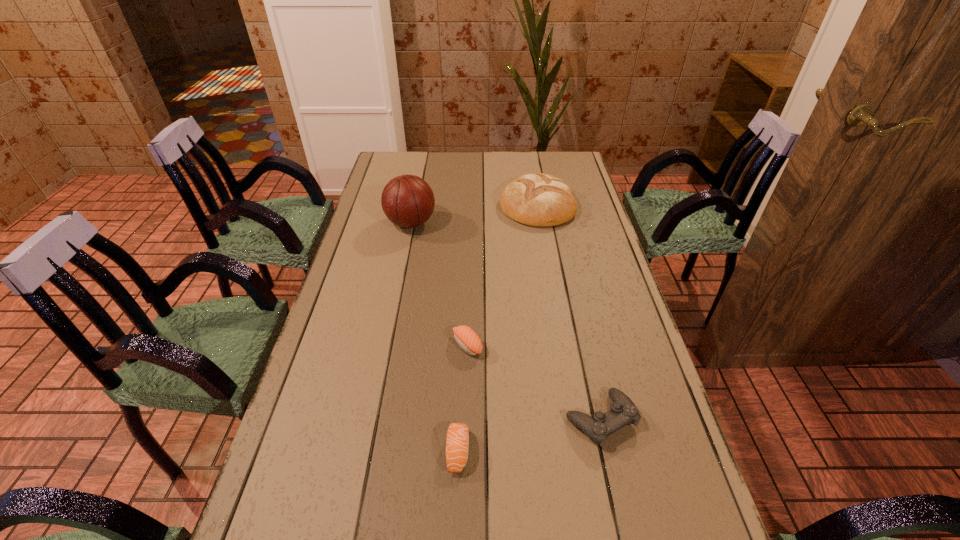
Locate an element on the screen. free space located on the front of the third farthest object is located at coordinates (464, 474).

In order to click on blank area located on the left of the control in this screenshot , I will do `click(540, 419)`.

The height and width of the screenshot is (540, 960). What are the coordinates of `free space located 0.140m on the left of the nearer sushi` in the screenshot? It's located at (381, 451).

Image resolution: width=960 pixels, height=540 pixels. What are the coordinates of `object that is positioned at the left edge` in the screenshot? It's located at (x=408, y=201).

Locate an element on the screen. This screenshot has width=960, height=540. bread that is at the right edge is located at coordinates (539, 199).

Locate an element on the screen. The width and height of the screenshot is (960, 540). control that is at the right edge is located at coordinates (623, 411).

The image size is (960, 540). I want to click on free space at the far edge of the desktop, so click(464, 160).

Locate an element on the screen. free space at the left edge of the desktop is located at coordinates (342, 292).

The width and height of the screenshot is (960, 540). Find the location of `vacant space at the right edge`. vacant space at the right edge is located at coordinates (625, 320).

Find the location of `vacant space at the far right corner`. vacant space at the far right corner is located at coordinates (565, 161).